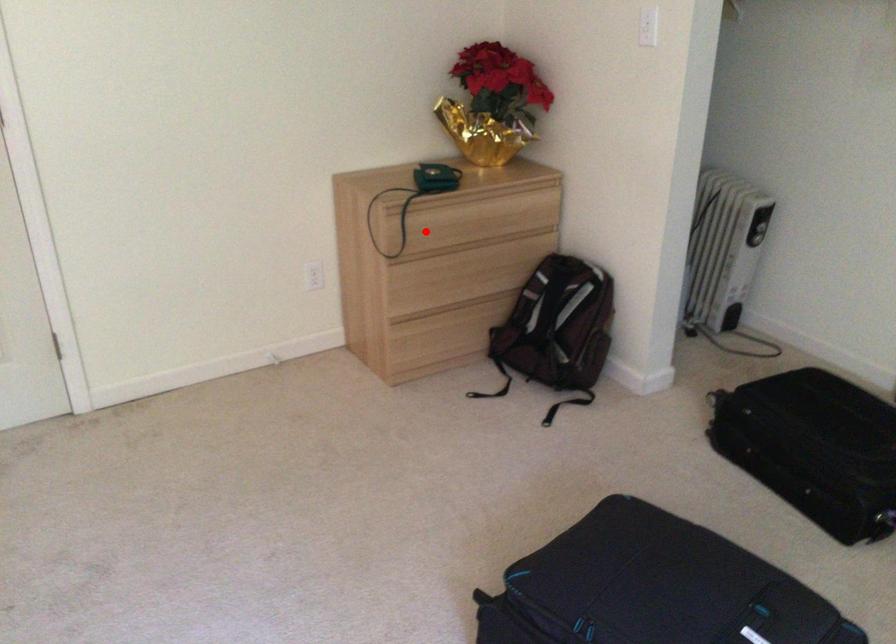
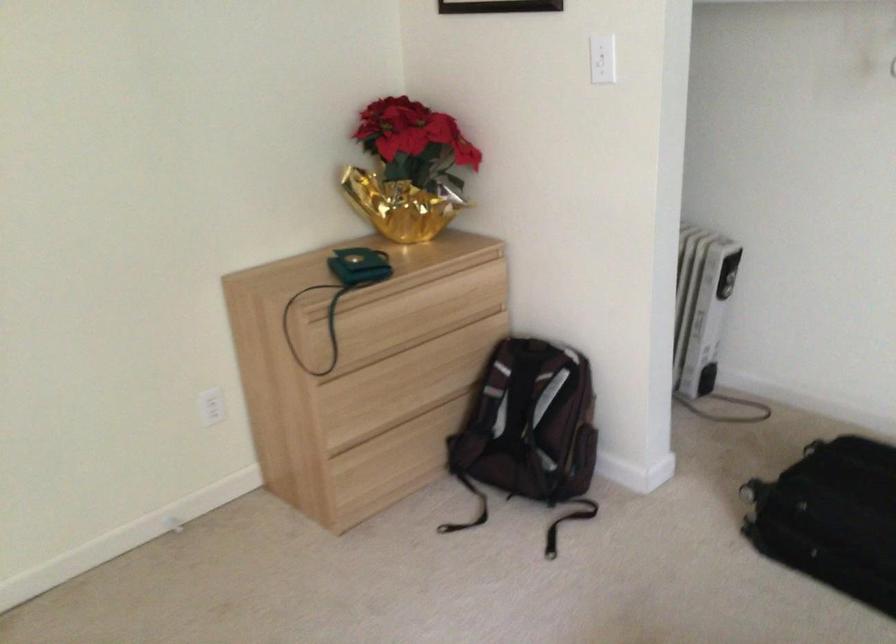
Question: I am providing you with two images of the same scene from different viewpoints. Given a red point in image1, look at the same physical point in image2. Is it:

Choices:
 (A) Closer to the viewpoint
 (B) Farther from the viewpoint

Answer: (A)